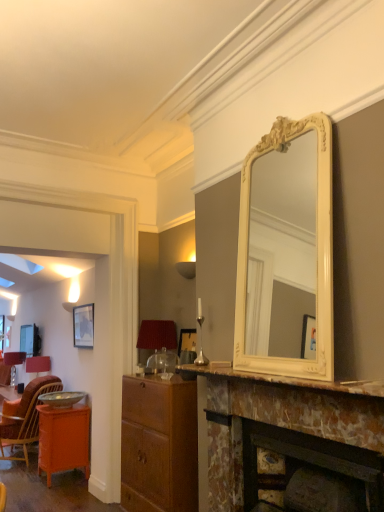
Question: Is wooden cabinet at center wider or thinner than matte red lampshade at center, which is counted as the first lamp, starting from the right?

Choices:
 (A) thin
 (B) wide

Answer: (B)

Question: Looking at the image, does wooden cabinet at center seem bigger or smaller compared to matte red lampshade at center, the first lamp positioned from the top?

Choices:
 (A) small
 (B) big

Answer: (B)

Question: Which is nearer to the wooden cabinet at center?

Choices:
 (A) orange glossy cabinet at lower left
 (B) metallic silver bowl at lower left
 (C) marble fireplace at center
 (D) matte black picture frame at upper left
 (E) marble/marbled fireplace at center

Answer: (C)

Question: Based on their relative distances, which object is nearer to the marble/marbled fireplace at center?

Choices:
 (A) matte black picture frame at upper left
 (B) marble fireplace at center
 (C) metallic silver bowl at lower left
 (D) matte red lampshade at left, marked as the second lamp in a top-to-bottom arrangement
 (E) orange wicker chair at lower left

Answer: (B)